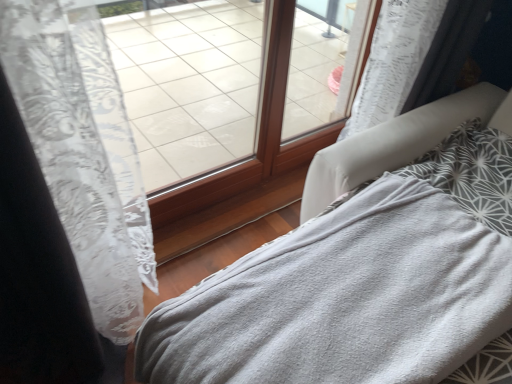
Question: Is gray soft blanket at lower right at the left side of transparent glass window at center, placed as the second window when sorted from right to left?

Choices:
 (A) yes
 (B) no

Answer: (B)

Question: Considering the relative sizes of gray soft blanket at lower right and transparent glass window at center, acting as the first window starting from the left, in the image provided, is gray soft blanket at lower right wider than transparent glass window at center, acting as the first window starting from the left,?

Choices:
 (A) yes
 (B) no

Answer: (A)

Question: Is gray soft blanket at lower right bigger than transparent glass window at center, placed as the second window when sorted from right to left?

Choices:
 (A) no
 (B) yes

Answer: (B)

Question: Is gray soft blanket at lower right closer to the viewer compared to transparent glass window at center, acting as the first window starting from the left?

Choices:
 (A) yes
 (B) no

Answer: (A)

Question: Is gray soft blanket at lower right positioned beyond the bounds of transparent glass window at center, acting as the first window starting from the left?

Choices:
 (A) yes
 (B) no

Answer: (A)

Question: Considering the relative sizes of gray soft blanket at lower right and transparent glass window at center, acting as the first window starting from the left, in the image provided, is gray soft blanket at lower right taller than transparent glass window at center, acting as the first window starting from the left,?

Choices:
 (A) yes
 (B) no

Answer: (B)

Question: Can you confirm if transparent glass window at center, arranged as the first window when viewed from the right, is shorter than transparent glass window at center, placed as the second window when sorted from right to left?

Choices:
 (A) no
 (B) yes

Answer: (B)

Question: Considering the relative sizes of transparent glass window at center, the 2th window from the left, and transparent glass window at center, placed as the second window when sorted from right to left, in the image provided, is transparent glass window at center, the 2th window from the left, wider than transparent glass window at center, placed as the second window when sorted from right to left,?

Choices:
 (A) no
 (B) yes

Answer: (A)

Question: Is transparent glass window at center, the 2th window from the left, taller than transparent glass window at center, placed as the second window when sorted from right to left?

Choices:
 (A) yes
 (B) no

Answer: (B)

Question: From the image's perspective, does transparent glass window at center, the 2th window from the left, appear lower than transparent glass window at center, placed as the second window when sorted from right to left?

Choices:
 (A) yes
 (B) no

Answer: (B)

Question: Is transparent glass window at center, the 2th window from the left, positioned far away from transparent glass window at center, placed as the second window when sorted from right to left?

Choices:
 (A) no
 (B) yes

Answer: (A)

Question: Is transparent glass window at center, the 2th window from the left, to the right of transparent glass window at center, acting as the first window starting from the left, from the viewer's perspective?

Choices:
 (A) yes
 (B) no

Answer: (A)

Question: From a real-world perspective, does gray soft blanket at lower right stand above transparent glass window at center, arranged as the first window when viewed from the right?

Choices:
 (A) no
 (B) yes

Answer: (A)